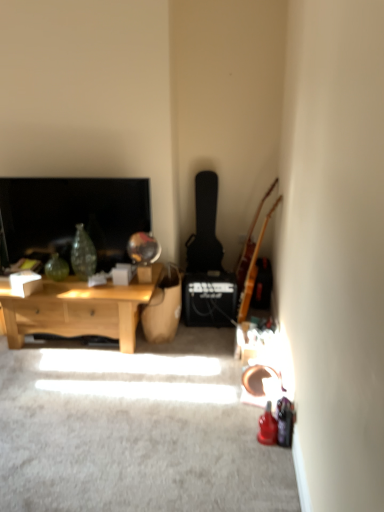
Question: Are black matte guitar at center-right, the 1th guitar when ordered from left to right, and matte black television at left beside each other?

Choices:
 (A) no
 (B) yes

Answer: (A)

Question: Is black matte guitar at center-right, which is the 2th guitar in right-to-left order, smaller than matte black television at left?

Choices:
 (A) no
 (B) yes

Answer: (A)

Question: Is black matte guitar at center-right, which is the 2th guitar in right-to-left order, at the right side of matte black television at left?

Choices:
 (A) yes
 (B) no

Answer: (A)

Question: From the image's perspective, is black matte guitar at center-right, which is the 2th guitar in right-to-left order, on matte black television at left?

Choices:
 (A) yes
 (B) no

Answer: (A)

Question: Considering the relative positions of black matte guitar at center-right, the 1th guitar when ordered from left to right, and matte black television at left in the image provided, is black matte guitar at center-right, the 1th guitar when ordered from left to right, in front of matte black television at left?

Choices:
 (A) no
 (B) yes

Answer: (A)

Question: Is light brown wooden guitar at right, which appears as the second guitar when viewed from the left, to the left or to the right of matte black television at left in the image?

Choices:
 (A) left
 (B) right

Answer: (B)

Question: Relative to matte black television at left, is light brown wooden guitar at right, which appears as the second guitar when viewed from the left, in front or behind?

Choices:
 (A) front
 (B) behind

Answer: (A)

Question: In terms of size, does light brown wooden guitar at right, which appears as the 1th guitar when viewed from the right, appear bigger or smaller than matte black television at left?

Choices:
 (A) small
 (B) big

Answer: (B)

Question: From the image's perspective, is light brown wooden guitar at right, which appears as the 1th guitar when viewed from the right, positioned above or below matte black television at left?

Choices:
 (A) below
 (B) above

Answer: (A)

Question: Is light brown wooden guitar at right, which appears as the 1th guitar when viewed from the right, in front of or behind black matte guitar at center-right, the 1th guitar when ordered from left to right, in the image?

Choices:
 (A) front
 (B) behind

Answer: (A)

Question: Is light brown wooden guitar at right, which appears as the 1th guitar when viewed from the right, spatially inside black matte guitar at center-right, which is the 2th guitar in right-to-left order, or outside of it?

Choices:
 (A) outside
 (B) inside

Answer: (A)

Question: From a real-world perspective, is light brown wooden guitar at right, which appears as the second guitar when viewed from the left, physically located above or below black matte guitar at center-right, which is the 2th guitar in right-to-left order?

Choices:
 (A) below
 (B) above

Answer: (A)

Question: Considering the positions of light brown wooden guitar at right, which appears as the second guitar when viewed from the left, and black matte guitar at center-right, the 1th guitar when ordered from left to right, in the image, is light brown wooden guitar at right, which appears as the second guitar when viewed from the left, wider or thinner than black matte guitar at center-right, the 1th guitar when ordered from left to right,?

Choices:
 (A) thin
 (B) wide

Answer: (A)

Question: Considering the relative positions of matte black television at left and light wood coffee table at left in the image provided, is matte black television at left to the left or to the right of light wood coffee table at left?

Choices:
 (A) left
 (B) right

Answer: (A)

Question: Relative to light wood coffee table at left, is matte black television at left in front or behind?

Choices:
 (A) front
 (B) behind

Answer: (B)